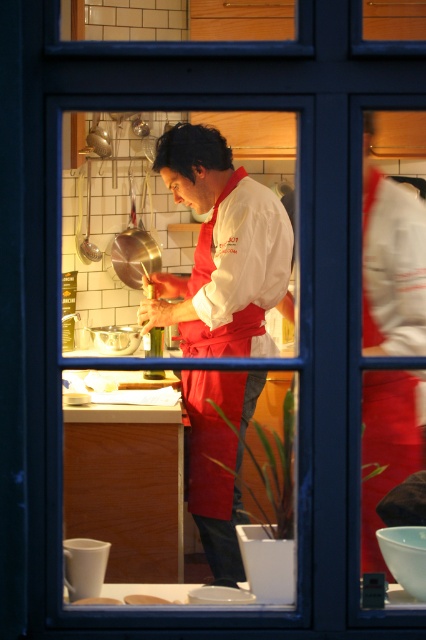
You are a chef standing in front of the kitchen window. You want to place both the white matte chef coat at center and the white matte bread at center on the counter. Which object should you place first to ensure both fit on the counter?

The white matte chef coat at center is wider than the white matte bread at center, so you should place the white matte chef coat at center first to ensure both fit on the counter.

You are a customer waiting outside the kitchen window. You see the white matte chef coat at center and the white matte bread at center through the window. Which object appears bigger in size?

→ The white matte chef coat at center appears bigger in size compared to the white matte bread at center.